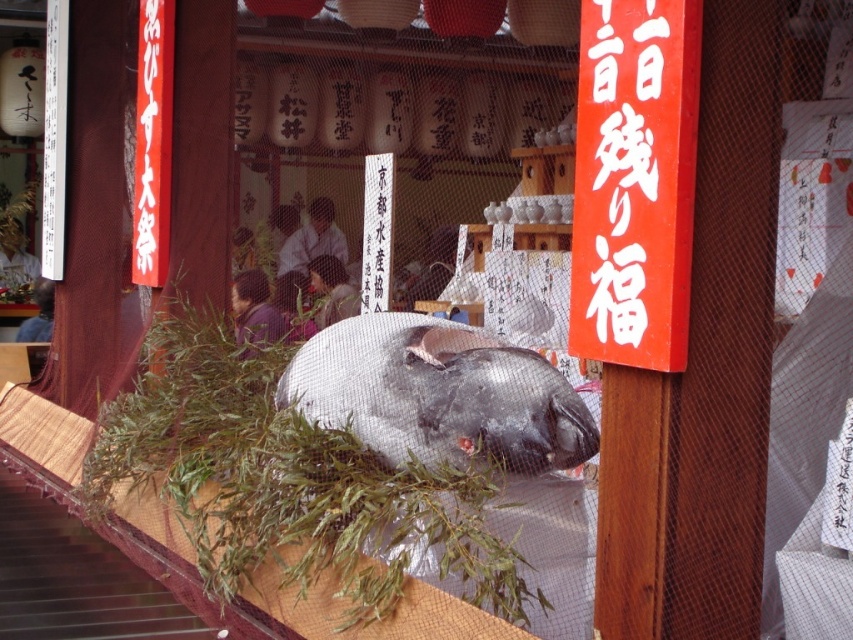
You are a tourist in Kyoto and see the shiny silver fish at center and the white paper sign at upper center in front of you. Which object is closer to you?

The shiny silver fish at center is closer to you than the white paper sign at upper center.

You are a customer at this Kyoto market and want to read the white paper sign at upper center. However, the shiny silver fish at center is blocking your view. Which direction should you move to see the sign clearly?

To see the white paper sign at upper center clearly, you should move to the right of the shiny silver fish at center since the fish is positioned to the left of the sign.